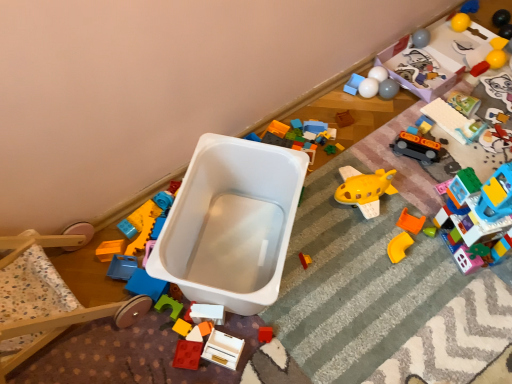
This screenshot has width=512, height=384. Find the location of `free space to the left of white glossy balls at upper right, the ninth toy positioned from the left`. free space to the left of white glossy balls at upper right, the ninth toy positioned from the left is located at coordinates (331, 97).